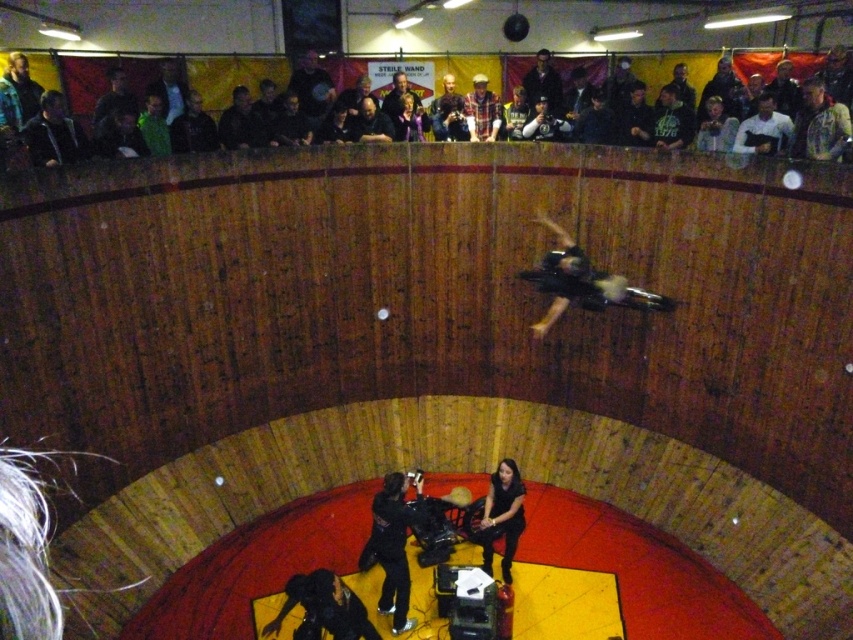
Question: Estimate the real-world distances between objects in this image. Which object is farther from the dark blue jacket at upper left?

Choices:
 (A) dark brown leather jacket at upper center
 (B) black matte skateboard at center
 (C) dark gray hoodie at upper left
 (D) dark green jersey at upper center

Answer: (D)

Question: Is black matte skateboard at center to the right of dark green jersey at upper center from the viewer's perspective?

Choices:
 (A) yes
 (B) no

Answer: (B)

Question: Does dark green jersey at upper center appear on the left side of dark brown leather jacket at upper center?

Choices:
 (A) yes
 (B) no

Answer: (B)

Question: Which of the following is the closest to the observer?

Choices:
 (A) black matte skateboard at center
 (B) dark blue jacket at upper center

Answer: (A)

Question: Considering the real-world distances, which object is closest to the dark gray hoodie at upper left?

Choices:
 (A) black leather pants at center
 (B) dark blue jacket at upper left
 (C) dark green jersey at upper center

Answer: (B)

Question: Can you confirm if dark blue jacket at upper center is smaller than dark gray hoodie at upper left?

Choices:
 (A) yes
 (B) no

Answer: (A)